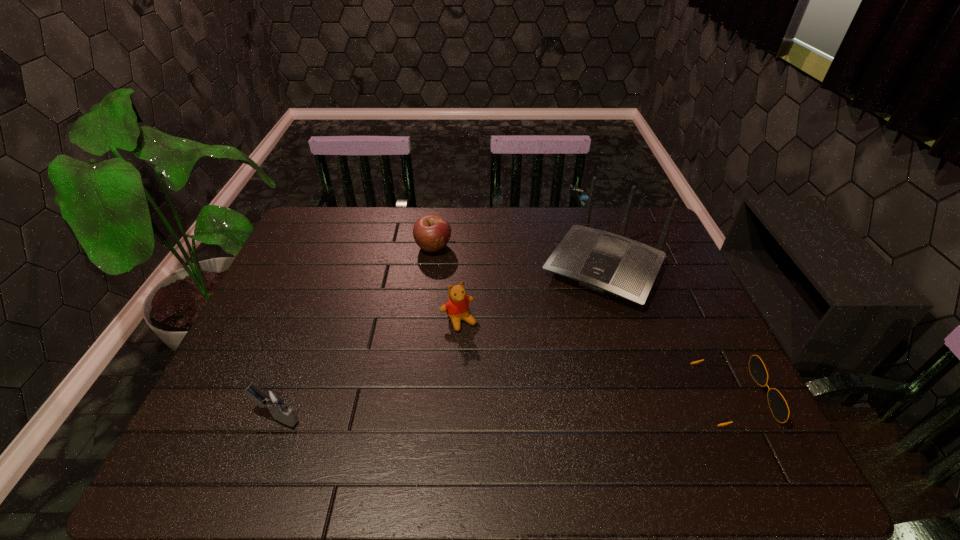
The image size is (960, 540). Find the location of `sunglasses that is positioned at the right edge`. sunglasses that is positioned at the right edge is located at coordinates (778, 405).

This screenshot has height=540, width=960. Identify the location of router at the right edge. (601, 261).

The image size is (960, 540). Find the location of `object located at the near left corner`. object located at the near left corner is located at coordinates (271, 400).

Where is `object that is at the far right corner`? This screenshot has width=960, height=540. object that is at the far right corner is located at coordinates (601, 261).

Find the location of `object that is at the near right corner`. object that is at the near right corner is located at coordinates (778, 405).

This screenshot has height=540, width=960. Find the location of `vacant area at the far edge`. vacant area at the far edge is located at coordinates (464, 243).

I want to click on vacant region at the near edge of the desktop, so click(x=319, y=417).

The width and height of the screenshot is (960, 540). In the image, there is a desktop. Find the location of `vacant area at the left edge`. vacant area at the left edge is located at coordinates (312, 256).

Identify the location of vacant area at the right edge of the desktop. This screenshot has width=960, height=540. (664, 340).

At what (x,y) coordinates should I click in order to perform the action: click on vacant area at the far left corner of the desktop. Please return your answer as a coordinate pair (x, y). Looking at the image, I should click on (338, 241).